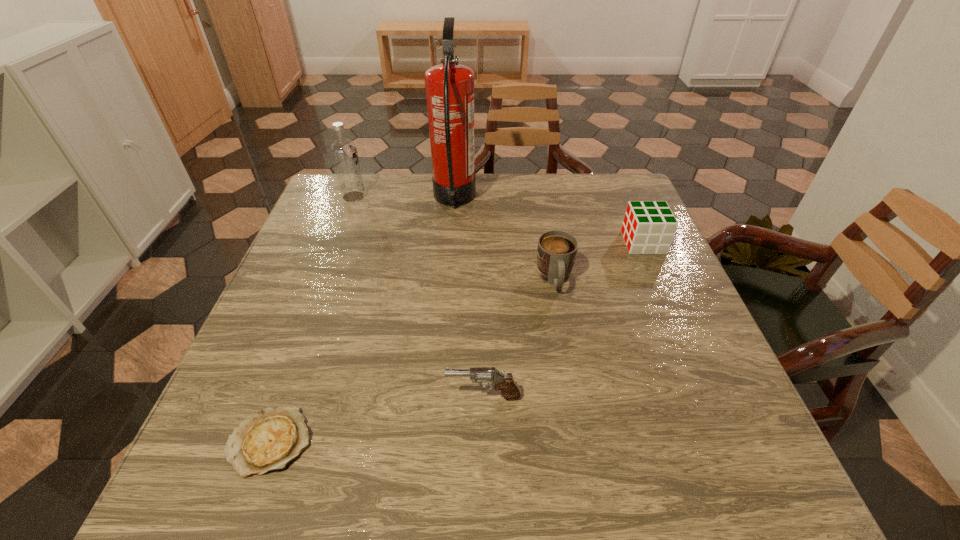
At what (x,y) coordinates should I click in order to perform the action: click on free space at the right edge. Please return your answer as a coordinate pair (x, y). The image size is (960, 540). Looking at the image, I should click on (673, 393).

Where is `vacant space at the near left corner of the desktop`? This screenshot has height=540, width=960. vacant space at the near left corner of the desktop is located at coordinates (221, 494).

Locate an element on the screen. The width and height of the screenshot is (960, 540). vacant area at the far right corner of the desktop is located at coordinates (588, 173).

Locate an element on the screen. The width and height of the screenshot is (960, 540). vacant area between the pistol and the quiche is located at coordinates (376, 419).

What are the coordinates of `free spot between the second nearest object and the vodka` in the screenshot? It's located at click(419, 296).

The image size is (960, 540). Identify the location of free space between the cube and the tallest object. (549, 221).

Find the location of a particular element. free space between the second tallest object and the pistol is located at coordinates tap(419, 296).

I want to click on empty location between the cube and the second object from right to left, so click(599, 261).

Image resolution: width=960 pixels, height=540 pixels. I want to click on vacant space that is in between the third nearest object and the rightmost object, so click(x=599, y=261).

You are a GUI agent. You are given a task and a screenshot of the screen. Output one action in this format:
    pyautogui.click(x=<x>, y=<y>)
    Task: Click on the vacant region between the pistol and the nearest object
    The width and height of the screenshot is (960, 540).
    Given the screenshot: What is the action you would take?
    pyautogui.click(x=376, y=419)